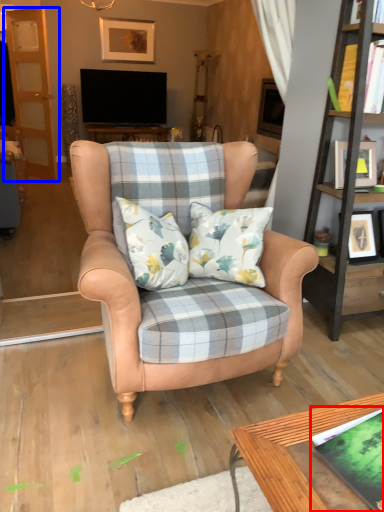
Question: Which object is further to the camera taking this photo, book (highlighted by a red box) or screen door (highlighted by a blue box)?

Choices:
 (A) book
 (B) screen door

Answer: (B)